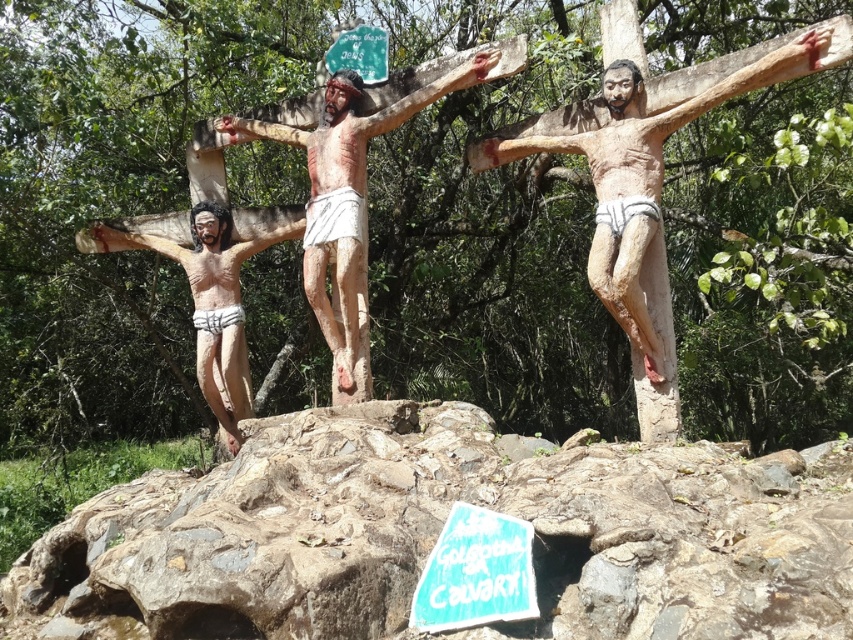
You are an archaeologist examining three wooden crucifixes on a rocky structure in a forest. You notice the matte wood crucifix at center and the matte wood crucifix at left. Which one is larger in size?

The matte wood crucifix at center is bigger than the matte wood crucifix at left.

You are an archaeologist examining the site. You need to determine which object is wider between the matte wood crucifix at left and the blue painted wood sign at lower center. Based on the scene, which one is wider?

The matte wood crucifix at left is wider than the blue painted wood sign at lower center according to the description.

You are a hiker who has just arrived at the forest area. You notice the rough stone boulder at center and the green plastic sign at upper center. Which object is bigger in size?

The rough stone boulder at center is larger in size than the green plastic sign at upper center.